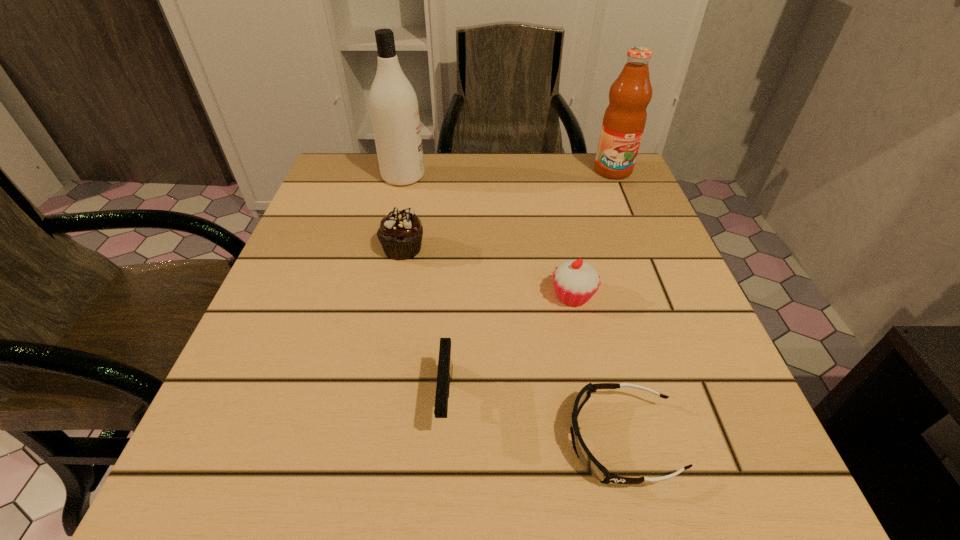
You are a GUI agent. You are given a task and a screenshot of the screen. Output one action in this format:
    pyautogui.click(x=<x>, y=<y>)
    Task: Click on the object that is at the left edge
    The width and height of the screenshot is (960, 540).
    Given the screenshot: What is the action you would take?
    pyautogui.click(x=393, y=103)

Where is `fruit juice that is at the right edge`? Image resolution: width=960 pixels, height=540 pixels. fruit juice that is at the right edge is located at coordinates (624, 120).

You are a GUI agent. You are given a task and a screenshot of the screen. Output one action in this format:
    pyautogui.click(x=<x>, y=<y>)
    Task: Click on the goggles that is at the right edge
    This screenshot has width=960, height=540.
    Given the screenshot: What is the action you would take?
    coord(594,467)

Find the location of a particular element. The image size is (960, 540). object that is at the far left corner is located at coordinates (393, 103).

The image size is (960, 540). Identify the location of object that is at the far right corner. (624, 120).

Find the location of a particular element. object present at the near right corner is located at coordinates (594, 467).

In the image, there is a desktop. Identify the location of vacant space at the far edge. (430, 172).

You are a GUI agent. You are given a task and a screenshot of the screen. Output one action in this format:
    pyautogui.click(x=<x>, y=<y>)
    Task: Click on the free region at the near edge of the desktop
    The width and height of the screenshot is (960, 540).
    Given the screenshot: What is the action you would take?
    pyautogui.click(x=475, y=485)

Image resolution: width=960 pixels, height=540 pixels. Find the location of `vacant region at the left edge`. vacant region at the left edge is located at coordinates (341, 305).

Image resolution: width=960 pixels, height=540 pixels. In the image, there is a desktop. Find the location of `vacant space at the right edge`. vacant space at the right edge is located at coordinates (627, 341).